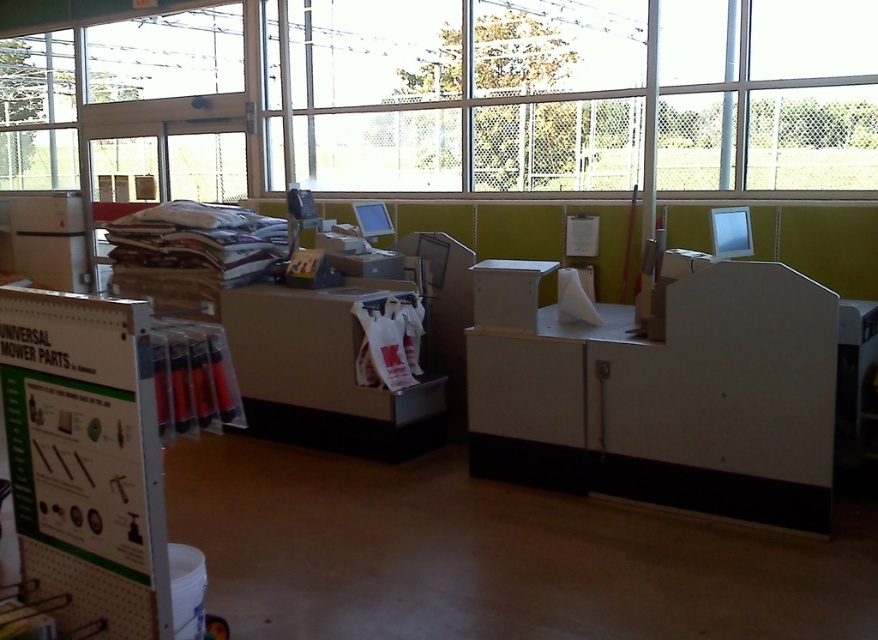
Based on the photo, you are a customer at the counter and want to reach both the white paper at upper left and the white paper bag at center. Which item is closer to you?

The white paper at upper left is closer to you because it is further to the viewer than the white paper bag at center.

You are a customer at the counter and want to place a white paper bag at center and a white matte box at center on the counter. If the counter has limited space, which item should you choose to place first to maximize space efficiency?

The white paper bag at center has a lesser width compared to the white matte box at center, so placing the white paper bag at center first would allow more space for the wider white matte box at center afterward.